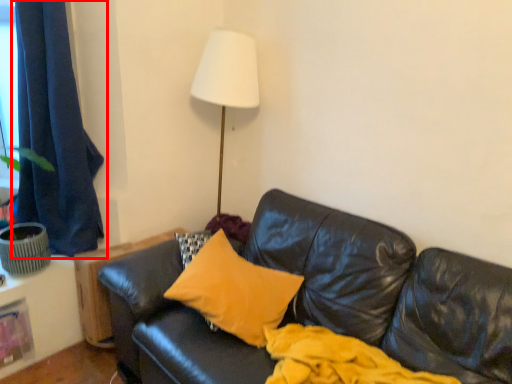
Question: From the image's perspective, what is the correct spatial relationship of curtain (annotated by the red box) in relation to pillow?

Choices:
 (A) above
 (B) below

Answer: (A)